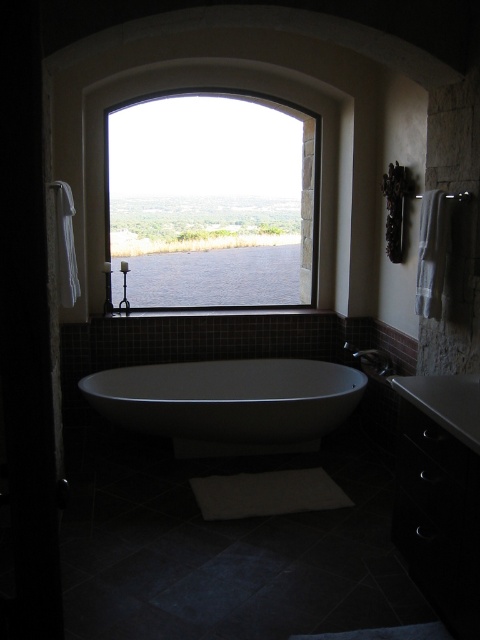
Does clear glass window at upper center have a greater width compared to white glossy sink at lower right?

Yes.

Is clear glass window at upper center in front of white glossy sink at lower right?

That is False.

Locate an element on the screen. clear glass window at upper center is located at coordinates (211, 193).

You are a GUI agent. You are given a task and a screenshot of the screen. Output one action in this format:
    pyautogui.click(x=<x>, y=<y>)
    Task: Click on the clear glass window at upper center
    
    Given the screenshot: What is the action you would take?
    pyautogui.click(x=211, y=193)

Does white glossy bathtub at center appear on the right side of white glossy sink at lower right?

No, white glossy bathtub at center is not to the right of white glossy sink at lower right.

Does white glossy bathtub at center have a greater width compared to white glossy sink at lower right?

Yes.

Who is more forward, (208, 435) or (468, 387)?

Positioned in front is point (468, 387).

Find the location of a particular element. The width and height of the screenshot is (480, 640). white glossy bathtub at center is located at coordinates (229, 403).

Does clear glass window at upper center appear over white glossy bathtub at center?

Indeed, clear glass window at upper center is positioned over white glossy bathtub at center.

Which is more to the right, clear glass window at upper center or white glossy bathtub at center?

From the viewer's perspective, white glossy bathtub at center appears more on the right side.

Where is `clear glass window at upper center`? The height and width of the screenshot is (640, 480). clear glass window at upper center is located at coordinates (211, 193).

Where is `clear glass window at upper center`? The height and width of the screenshot is (640, 480). clear glass window at upper center is located at coordinates (211, 193).